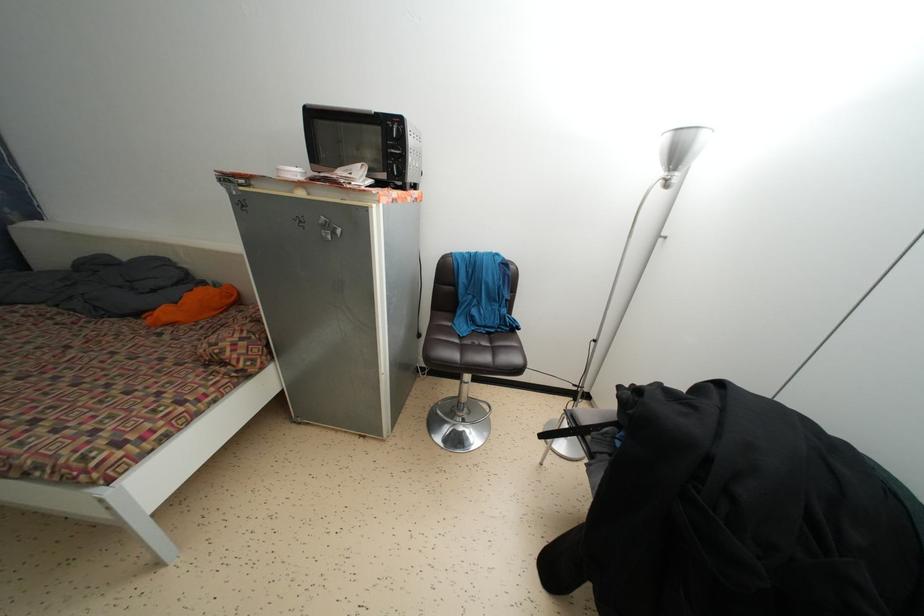
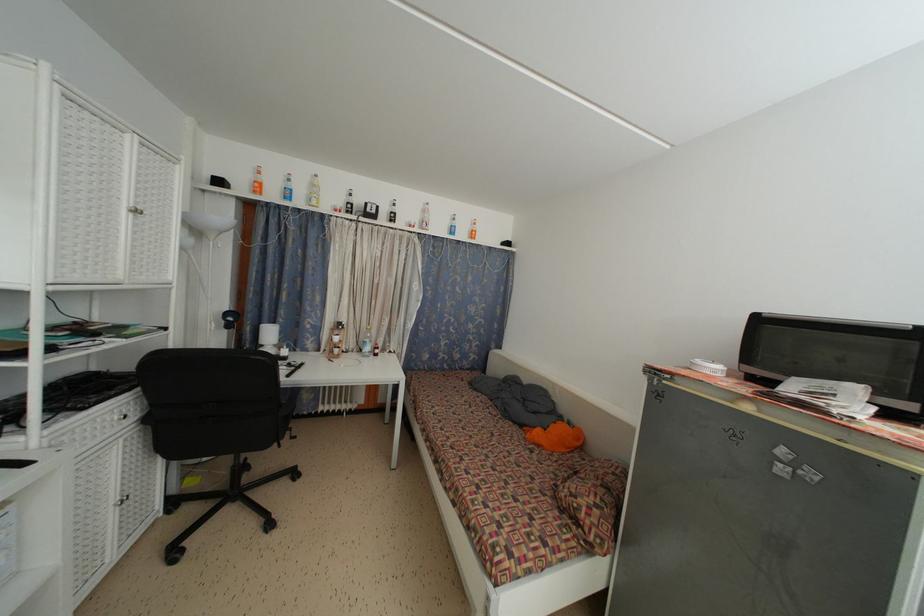
Question: Based on the continuous images, in which direction is the camera rotating? Reply with the corresponding letter.

Choices:
 (A) Left
 (B) Right
 (C) Up
 (D) Down

Answer: (A)